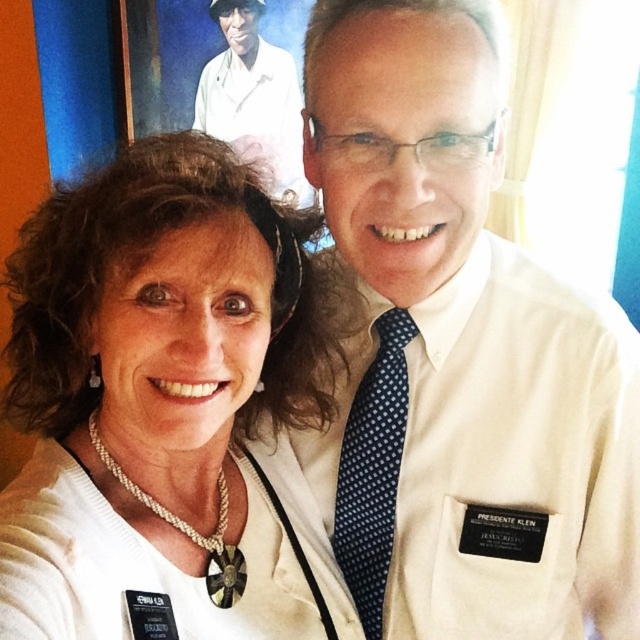
You are a photographer setting up for a group photo. You need to ensure that the blue dotted tie at center and the white smooth shirt at upper center are both in focus. The camera you are using has a depth of field that can cover 1.5 meters. Can both objects be in focus at the same time?

The distance between the blue dotted tie at center and the white smooth shirt at upper center is 1.36 meters, which is within the camera s 1.5 meter depth of field. Therefore, both objects can be in focus simultaneously.

You are a photographer adjusting the camera settings to ensure both the pearl necklace at center and the white smooth shirt at upper center are in focus. Which object should you prioritize focusing on to ensure it is sharp, considering their sizes relative to the camera lens?

The pearl necklace at center is wider than the white smooth shirt at upper center, so you should prioritize focusing on the pearl necklace at center to ensure it appears sharp in the photo.